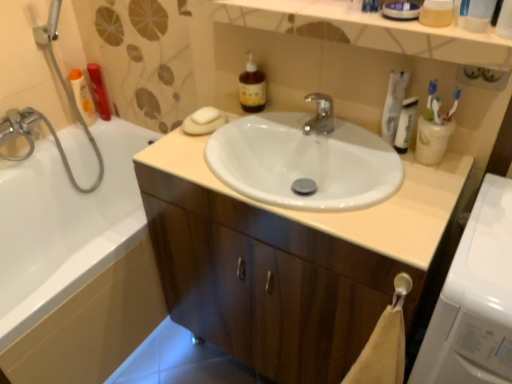
At what (x,y) coordinates should I click in order to perform the action: click on white glossy sink at center. Please return your answer as a coordinate pair (x, y). Image resolution: width=512 pixels, height=384 pixels. Looking at the image, I should click on (266, 281).

Describe the element at coordinates (205, 115) in the screenshot. The image size is (512, 384). I see `white matte soap at upper center` at that location.

Describe the element at coordinates (82, 96) in the screenshot. I see `translucent plastic bottle at upper left, which appears as the 2th mouthwash when viewed from the front` at that location.

The width and height of the screenshot is (512, 384). What do you see at coordinates (432, 141) in the screenshot?
I see `white plastic cup at upper right` at bounding box center [432, 141].

The height and width of the screenshot is (384, 512). I want to click on white glossy sink at center, so click(x=266, y=281).

Is translucent plastic mouthwash at upper left, which ranks as the second mouthwash in left-to-right order, aimed at white glossy bathtub at left?

No, translucent plastic mouthwash at upper left, which ranks as the second mouthwash in left-to-right order, is not oriented towards white glossy bathtub at left.

Identify the location of the 3rd mouthwash above the white glossy bathtub at left (from the image's perspective). (98, 91).

Would you say white glossy bathtub at left is part of translucent plastic mouthwash at upper left, which ranks as the second mouthwash in left-to-right order,'s contents?

No, translucent plastic mouthwash at upper left, which ranks as the second mouthwash in left-to-right order, does not contain white glossy bathtub at left.

Consider the image. Would you say blue plastic toothbrush at upper right, the first toothbrush from the left, is inside or outside white glossy tube at upper right?

blue plastic toothbrush at upper right, the first toothbrush from the left, is outside white glossy tube at upper right.

Is blue plastic toothbrush at upper right, the first toothbrush from the left, with white glossy tube at upper right?

Yes, blue plastic toothbrush at upper right, the first toothbrush from the left, is with white glossy tube at upper right.

Is blue plastic toothbrush at upper right, the first toothbrush from the left, turned away from white glossy tube at upper right?

No, white glossy tube at upper right is not at the back of blue plastic toothbrush at upper right, the first toothbrush from the left.

Where is `toothpaste located below the blue plastic toothbrush at upper right, the first toothbrush from the left (from the image's perspective)`? toothpaste located below the blue plastic toothbrush at upper right, the first toothbrush from the left (from the image's perspective) is located at coordinates (394, 104).

The height and width of the screenshot is (384, 512). I want to click on toothbrush that is the 2nd object above the white glossy washing machine at right (from a real-world perspective), so click(430, 100).

Considering the sizes of objects white glossy washing machine at right and blue plastic toothbrush at upper right, the first toothbrush from the left, in the image provided, who is bigger, white glossy washing machine at right or blue plastic toothbrush at upper right, the first toothbrush from the left,?

white glossy washing machine at right.

Is white glossy washing machine at right wider than blue plastic toothbrush at upper right, the first toothbrush from the left?

Indeed, white glossy washing machine at right has a greater width compared to blue plastic toothbrush at upper right, the first toothbrush from the left.

Visually, is translucent amber liquid at upper center positioned to the left or to the right of blue plastic toothbrush at upper right, marked as the second toothbrush in a right-to-left arrangement?

Based on their positions, translucent amber liquid at upper center is located to the left of blue plastic toothbrush at upper right, marked as the second toothbrush in a right-to-left arrangement.

From the picture: Can you confirm if translucent amber liquid at upper center is wider than blue plastic toothbrush at upper right, marked as the second toothbrush in a right-to-left arrangement?

Indeed, translucent amber liquid at upper center has a greater width compared to blue plastic toothbrush at upper right, marked as the second toothbrush in a right-to-left arrangement.

Considering the sizes of objects translucent amber liquid at upper center and blue plastic toothbrush at upper right, marked as the second toothbrush in a right-to-left arrangement, in the image provided, who is smaller, translucent amber liquid at upper center or blue plastic toothbrush at upper right, marked as the second toothbrush in a right-to-left arrangement,?

blue plastic toothbrush at upper right, marked as the second toothbrush in a right-to-left arrangement.

Does translucent amber liquid at upper center lie behind blue plastic toothbrush at upper right, the first toothbrush from the left?

Yes, the depth of translucent amber liquid at upper center is greater than that of blue plastic toothbrush at upper right, the first toothbrush from the left.

Consider the image. Is white plastic cup at upper right not near translucent plastic mouthwash at upper left, marked as the 2th mouthwash in a right-to-left arrangement?

That's right, there is a large distance between white plastic cup at upper right and translucent plastic mouthwash at upper left, marked as the 2th mouthwash in a right-to-left arrangement.

From a real-world perspective, between white plastic cup at upper right and translucent plastic mouthwash at upper left, which ranks as the third mouthwash in front-to-back order, who is vertically higher?

white plastic cup at upper right is physically above.

Considering the positions of point (425, 148) and point (102, 97), is point (425, 148) closer or farther from the camera than point (102, 97)?

Clearly, point (425, 148) is closer to the camera than point (102, 97).

Can you confirm if white plastic cup at upper right is taller than translucent plastic mouthwash at upper left, marked as the 2th mouthwash in a right-to-left arrangement?

No.

Which object is positioned more to the right, translucent plastic mouthwash at upper left, which ranks as the second mouthwash in left-to-right order, or white glossy tube at upper right?

white glossy tube at upper right is more to the right.

Does translucent plastic mouthwash at upper left, marked as the 2th mouthwash in a right-to-left arrangement, have a lesser width compared to white glossy tube at upper right?

No.

Locate an element on the screen. This screenshot has width=512, height=384. toothpaste above the translucent plastic mouthwash at upper left, marked as the 2th mouthwash in a right-to-left arrangement (from a real-world perspective) is located at coordinates (394, 104).

Does translucent plastic mouthwash at upper left, arranged as the first mouthwash when viewed from the back, have a greater height compared to white glossy tube at upper right?

Correct, translucent plastic mouthwash at upper left, arranged as the first mouthwash when viewed from the back, is much taller as white glossy tube at upper right.

Considering their positions, is blue plastic toothbrush at upper right, the first toothbrush from the left, located in front of or behind translucent amber liquid at upper center?

Visually, blue plastic toothbrush at upper right, the first toothbrush from the left, is located in front of translucent amber liquid at upper center.

What's the angular difference between blue plastic toothbrush at upper right, the first toothbrush from the left, and translucent amber liquid at upper center's facing directions?

The facing directions of blue plastic toothbrush at upper right, the first toothbrush from the left, and translucent amber liquid at upper center are 0.453 degrees apart.

Is blue plastic toothbrush at upper right, marked as the second toothbrush in a right-to-left arrangement, taller or shorter than translucent amber liquid at upper center?

In the image, blue plastic toothbrush at upper right, marked as the second toothbrush in a right-to-left arrangement, appears to be shorter than translucent amber liquid at upper center.

Is translucent amber liquid at upper center completely or partially inside blue plastic toothbrush at upper right, the first toothbrush from the left?

No, translucent amber liquid at upper center is not surrounded by blue plastic toothbrush at upper right, the first toothbrush from the left.

Image resolution: width=512 pixels, height=384 pixels. I want to click on the 1st mouthwash counting from the left side of the white glossy bathtub at left, so click(98, 91).

You are a GUI agent. You are given a task and a screenshot of the screen. Output one action in this format:
    pyautogui.click(x=<x>, y=<y>)
    Task: Click on the toothbrush that is the 2nd one above the white glossy tube at upper right (from a real-world perspective)
    
    Given the screenshot: What is the action you would take?
    pyautogui.click(x=430, y=100)

Which object lies further to the anchor point white glossy washing machine at right, white glossy tube at upper right or blue plastic toothbrush at upper right, the first toothbrush from the left?

white glossy tube at upper right is positioned further to the anchor white glossy washing machine at right.

Estimate the real-world distances between objects in this image. Which object is further from white glossy sink at center, blue plastic toothbrush at upper right, marked as the second toothbrush in a right-to-left arrangement, or white matte soap at upper center?

Among the two, white matte soap at upper center is located further to white glossy sink at center.

Which object lies nearer to the anchor point white glossy tube at upper right, blue plastic toothbrush at upper right, the first toothbrush from the left, or white matte soap at upper center?

The object closer to white glossy tube at upper right is blue plastic toothbrush at upper right, the first toothbrush from the left.

Which object lies nearer to the anchor point white glossy washing machine at right, white glossy sink at center or translucent plastic bottle at upper left, the third mouthwash viewed from the right?

white glossy sink at center is closer to white glossy washing machine at right.

Looking at the image, which one is located further to translucent plastic bottle at upper left, marked as the 1th mouthwash in a left-to-right arrangement, white glossy washing machine at right or white plastic cup at upper right?

The object further to translucent plastic bottle at upper left, marked as the 1th mouthwash in a left-to-right arrangement, is white glossy washing machine at right.

Based on their spatial positions, is white plastic cup at upper right or white plastic tube at upper right, which appears as the 1th mouthwash when viewed from the right, closer to white glossy sink at center?

Among the two, white plastic cup at upper right is located nearer to white glossy sink at center.

When comparing their distances from translucent plastic mouthwash at upper left, which ranks as the second mouthwash in left-to-right order, does white plastic cup at upper right or blue plastic toothbrush at upper right, the first toothbrush from the left, seem closer?

white plastic cup at upper right is closer to translucent plastic mouthwash at upper left, which ranks as the second mouthwash in left-to-right order.

Based on their spatial positions, is white glossy sink at center or white plastic cup at upper right closer to white plastic toothbrush at upper right, acting as the first toothbrush starting from the right?

Among the two, white plastic cup at upper right is located nearer to white plastic toothbrush at upper right, acting as the first toothbrush starting from the right.

You are a GUI agent. You are given a task and a screenshot of the screen. Output one action in this format:
    pyautogui.click(x=<x>, y=<y>)
    Task: Click on the bathroom cabinet between translucent plastic mouthwash at upper left, which ranks as the third mouthwash in front-to-back order, and blue plastic toothbrush at upper right, marked as the second toothbrush in a right-to-left arrangement, in the horizontal direction
    This screenshot has width=512, height=384.
    Given the screenshot: What is the action you would take?
    pyautogui.click(x=266, y=281)

The image size is (512, 384). I want to click on counter top situated between translucent plastic mouthwash at upper left, which ranks as the second mouthwash in left-to-right order, and white glossy washing machine at right from left to right, so click(346, 211).

Where is `counter top between white plastic tube at upper right, which is counted as the third mouthwash, starting from the left, and white glossy sink at center from top to bottom`? counter top between white plastic tube at upper right, which is counted as the third mouthwash, starting from the left, and white glossy sink at center from top to bottom is located at coordinates (346, 211).

This screenshot has width=512, height=384. Find the location of `toilet paper between white glossy tube at upper right and white glossy washing machine at right vertically`. toilet paper between white glossy tube at upper right and white glossy washing machine at right vertically is located at coordinates (432, 141).